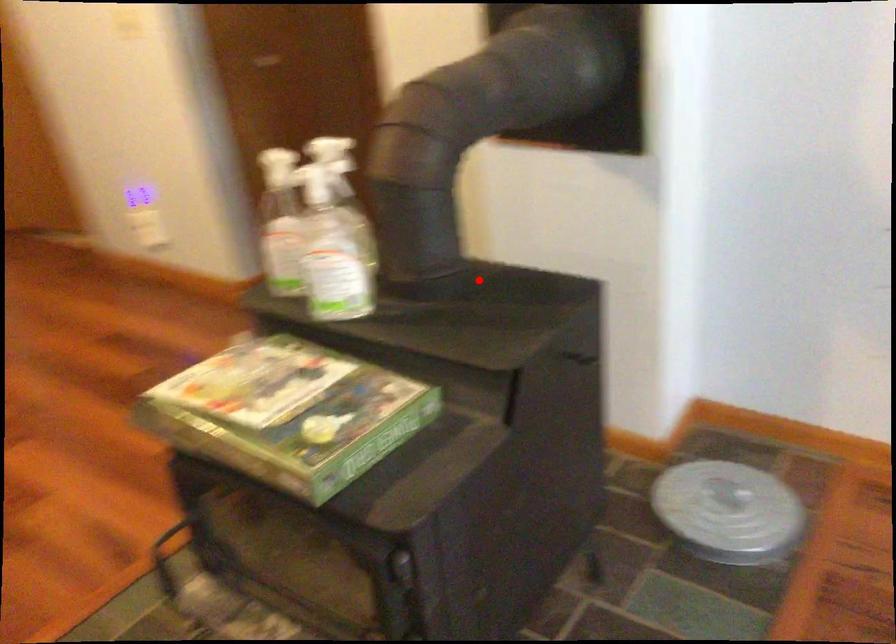
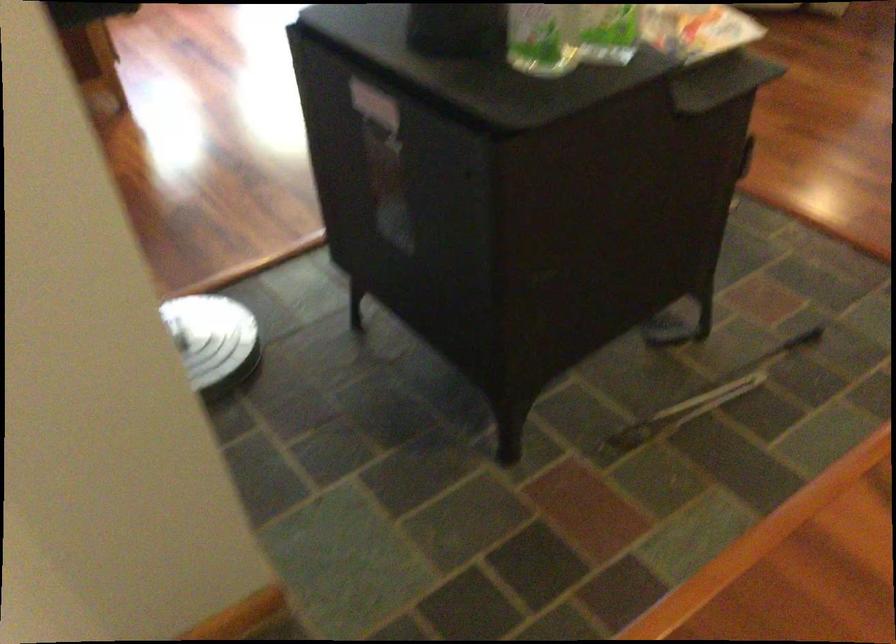
Question: I am providing you with two images of the same scene from different viewpoints. In image1, a red point is highlighted. Considering the same 3D point in image2, which of the following is correct?

Choices:
 (A) It is closer
 (B) It is farther

Answer: (A)